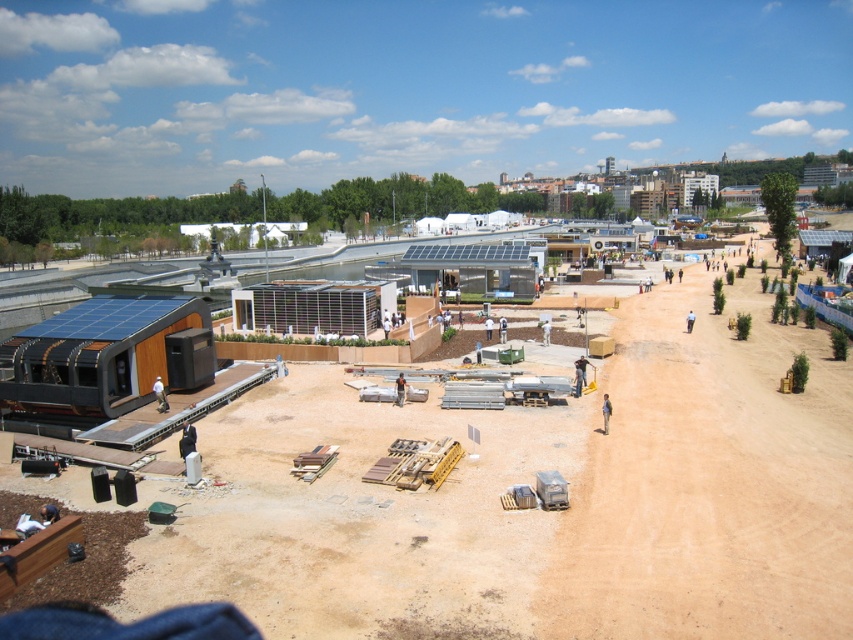
You are a GUI agent. You are given a task and a screenshot of the screen. Output one action in this format:
    pyautogui.click(x=<x>, y=<y>)
    Task: Click on the brown wooden construction site at center
    The height and width of the screenshot is (640, 853).
    Given the screenshot: What is the action you would take?
    pyautogui.click(x=538, y=509)